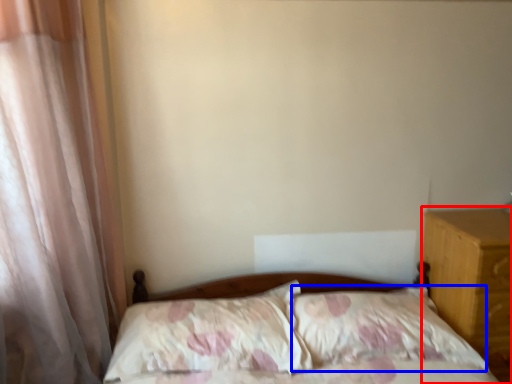
Question: Which of the following is the farthest to the observer, nightstand (highlighted by a red box) or pillow (highlighted by a blue box)?

Choices:
 (A) nightstand
 (B) pillow

Answer: (A)